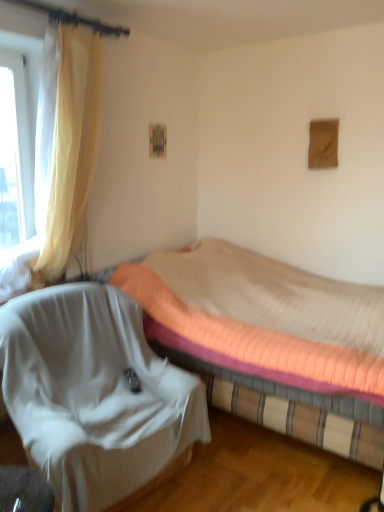
Question: Looking at their shapes, would you say pink quilted mattress at center is wider or thinner than transparent glass window at left?

Choices:
 (A) wide
 (B) thin

Answer: (A)

Question: From the image's perspective, is pink quilted mattress at center located above or below transparent glass window at left?

Choices:
 (A) above
 (B) below

Answer: (B)

Question: Estimate the real-world distances between objects in this image. Which object is farther from the transparent glass window at left?

Choices:
 (A) white fabric chair at lower left
 (B) pink quilted mattress at center
 (C) yellow sheer curtain at left

Answer: (B)

Question: Which object is positioned closest to the transparent glass window at left?

Choices:
 (A) white fabric chair at lower left
 (B) pink quilted mattress at center
 (C) yellow sheer curtain at left

Answer: (C)